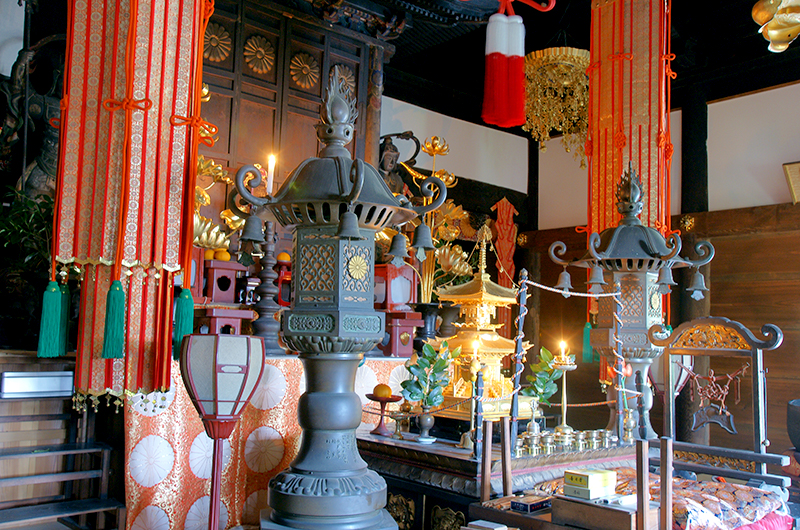
This screenshot has height=530, width=800. In order to click on tassel in this screenshot , I will do `click(102, 323)`, `click(42, 325)`, `click(169, 317)`.